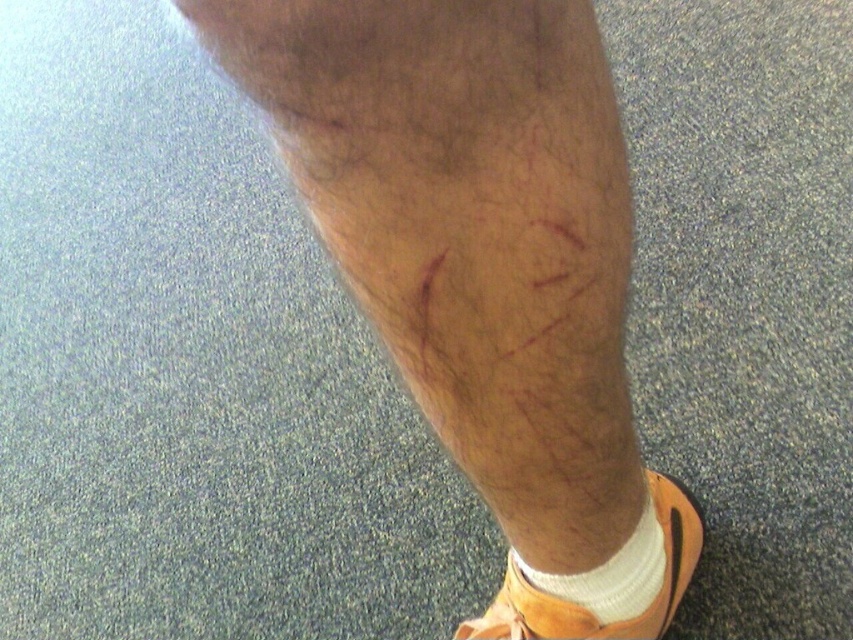
Question: Estimate the real-world distances between objects in this image. Which object is closer to the white soft sock at lower right?

Choices:
 (A) hair-covered skin at center
 (B) orange leather sandal at lower right

Answer: (B)

Question: Is orange leather sandal at lower right positioned in front of white soft sock at lower right?

Choices:
 (A) no
 (B) yes

Answer: (A)

Question: Is hair-covered skin at center smaller than white soft sock at lower right?

Choices:
 (A) yes
 (B) no

Answer: (B)

Question: Among these objects, which one is nearest to the camera?

Choices:
 (A) orange leather sandal at lower right
 (B) white soft sock at lower right

Answer: (B)

Question: Which of the following is the farthest from the observer?

Choices:
 (A) (364, 291)
 (B) (611, 556)

Answer: (B)

Question: Is orange leather sandal at lower right to the left of white soft sock at lower right from the viewer's perspective?

Choices:
 (A) no
 (B) yes

Answer: (B)